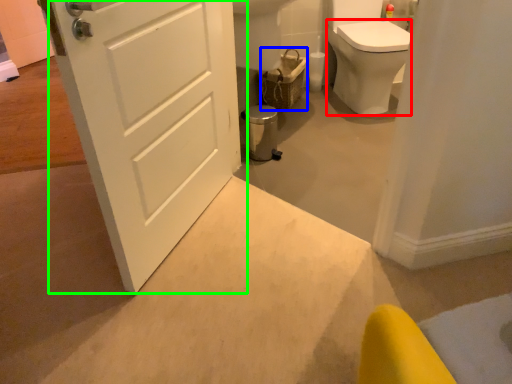
Question: Which is nearer to the bidet (highlighted by a red box)? basket (highlighted by a blue box) or door (highlighted by a green box).

Choices:
 (A) basket
 (B) door

Answer: (A)